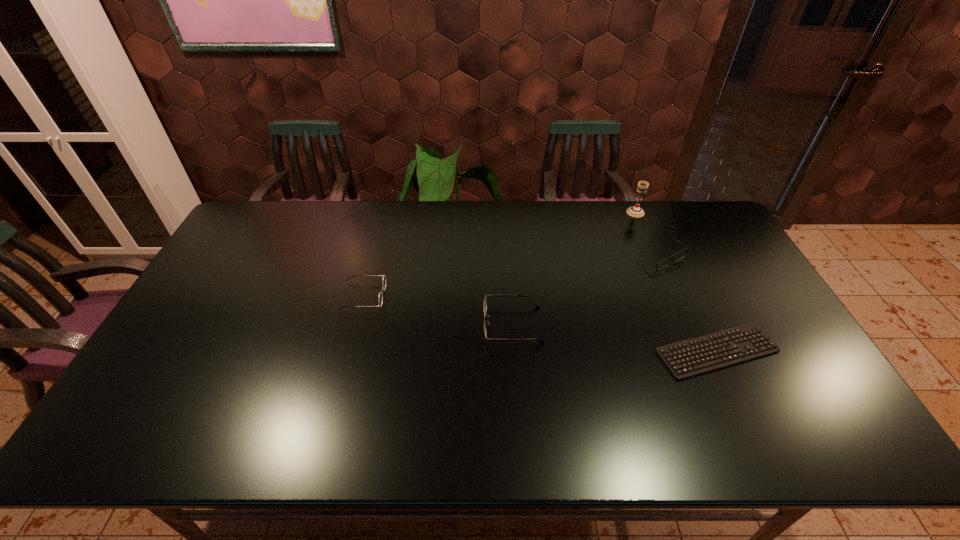
Identify the location of the farthest object. The height and width of the screenshot is (540, 960). tap(635, 211).

Where is `chalice`? The height and width of the screenshot is (540, 960). chalice is located at coordinates (635, 211).

The image size is (960, 540). I want to click on the farthest spectacles, so click(x=681, y=254).

Identify the location of the rightmost spectacles. This screenshot has height=540, width=960. (681, 254).

The height and width of the screenshot is (540, 960). What are the coordinates of `the leftmost object` in the screenshot? It's located at (384, 277).

Locate an element on the screen. The height and width of the screenshot is (540, 960). the second spectacles from right to left is located at coordinates (485, 301).

Image resolution: width=960 pixels, height=540 pixels. Find the location of `the fourth object from right to left`. the fourth object from right to left is located at coordinates (485, 301).

Where is `computer keyboard`? The image size is (960, 540). computer keyboard is located at coordinates (751, 328).

Locate an element on the screen. This screenshot has height=540, width=960. vacant region located on the right of the chalice is located at coordinates pyautogui.click(x=682, y=212).

The height and width of the screenshot is (540, 960). Find the location of `vacant space located 0.190m with the lenses facing outward on the fourth nearest object`. vacant space located 0.190m with the lenses facing outward on the fourth nearest object is located at coordinates (686, 316).